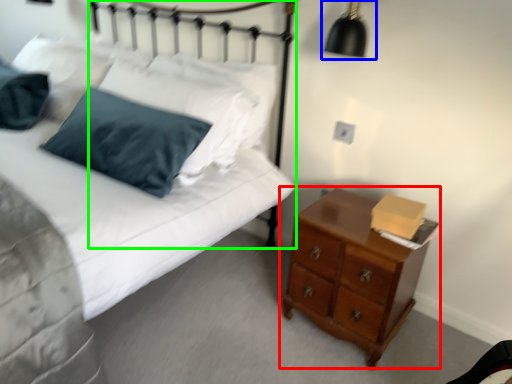
Question: Considering the real-world distances, which object is farthest from chest of drawers (highlighted by a red box)? lamp (highlighted by a blue box) or headboard (highlighted by a green box)?

Choices:
 (A) lamp
 (B) headboard

Answer: (B)